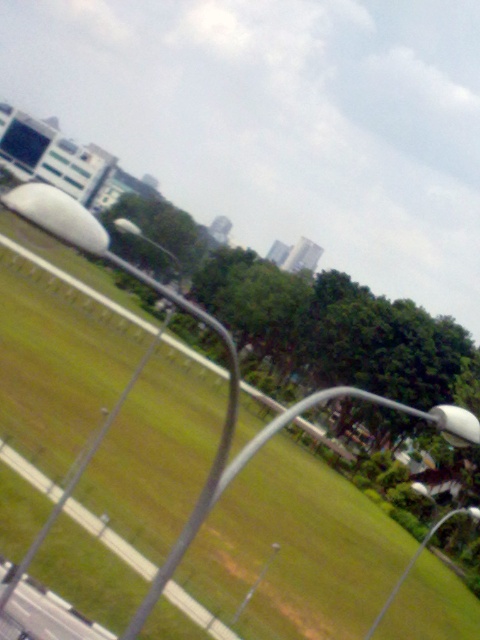
Question: From the image, what is the correct spatial relationship of green grass at center in relation to white glossy lamp post at lower right?

Choices:
 (A) left
 (B) right

Answer: (A)

Question: Is green grass at center positioned before white glossy lamp post at lower right?

Choices:
 (A) yes
 (B) no

Answer: (A)

Question: Which point appears closest to the camera in this image?

Choices:
 (A) (471, 509)
 (B) (170, 392)

Answer: (A)

Question: Which point is closer to the camera taking this photo?

Choices:
 (A) (101, 326)
 (B) (460, 509)

Answer: (B)

Question: Which of the following is the closest to the observer?

Choices:
 (A) white glossy lamp post at lower right
 (B) green grass at center

Answer: (B)

Question: Does green grass at center appear on the left side of white glossy lamp post at lower right?

Choices:
 (A) yes
 (B) no

Answer: (A)